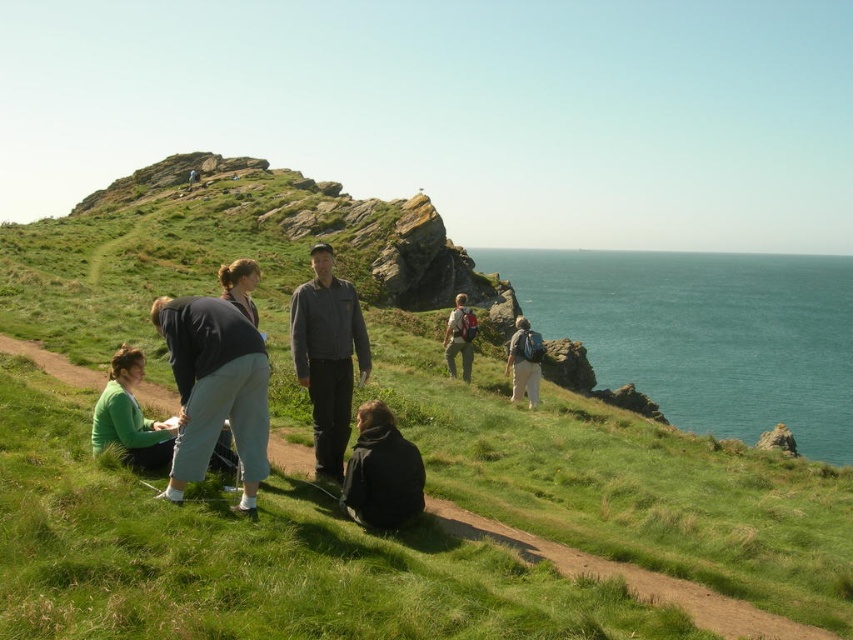
Between point (196, 408) and point (526, 344), which one is positioned behind?

Positioned behind is point (526, 344).

Does dark blue fabric jacket at lower left have a greater height compared to light gray backpack at center?

Correct, dark blue fabric jacket at lower left is much taller as light gray backpack at center.

Between point (254, 458) and point (537, 400), which one is positioned behind?

Point (537, 400)

This screenshot has width=853, height=640. Identify the location of dark blue fabric jacket at lower left. (213, 388).

Locate an element on the screen. The image size is (853, 640). dark blue fabric jacket at lower left is located at coordinates (213, 388).

Does dark blue fabric jacket at lower left have a lesser width compared to dark blue jacket at center?

Indeed, dark blue fabric jacket at lower left has a lesser width compared to dark blue jacket at center.

Between point (250, 378) and point (256, 326), which one is positioned in front?

Point (250, 378)

At what (x,y) coordinates should I click in order to perform the action: click on dark blue fabric jacket at lower left. Please return your answer as a coordinate pair (x, y). The height and width of the screenshot is (640, 853). Looking at the image, I should click on (213, 388).

Find the location of a particular element. The image size is (853, 640). green sweater at lower left is located at coordinates (131, 417).

Who is shorter, green sweater at lower left or matte gray backpack at center?

Standing shorter between the two is green sweater at lower left.

Is point (115, 390) positioned behind point (456, 326)?

No, it is not.

At what (x,y) coordinates should I click in order to perform the action: click on green sweater at lower left. Please return your answer as a coordinate pair (x, y). The width and height of the screenshot is (853, 640). Looking at the image, I should click on (131, 417).